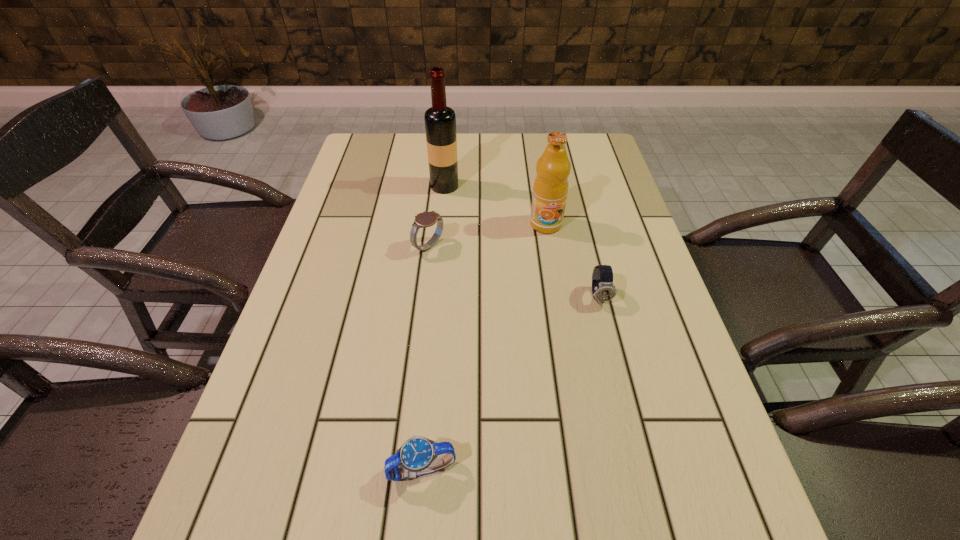
Identify the location of the farthest object. The width and height of the screenshot is (960, 540). (440, 121).

In order to click on the tallest object in this screenshot , I will do `click(440, 121)`.

The width and height of the screenshot is (960, 540). Find the location of `the second farthest object`. the second farthest object is located at coordinates (550, 189).

The image size is (960, 540). I want to click on the fourth shortest object, so click(550, 189).

Find the location of a particular element. the farthest watch is located at coordinates (425, 219).

The image size is (960, 540). What are the coordinates of `the rightmost object` in the screenshot? It's located at (603, 289).

Locate an element on the screen. the second farthest watch is located at coordinates (603, 289).

Where is `the nearest object`? This screenshot has height=540, width=960. the nearest object is located at coordinates (417, 456).

What are the coordinates of `the shortest watch` in the screenshot? It's located at (417, 456).

This screenshot has height=540, width=960. What are the coordinates of `free region located on the left of the tallest object` in the screenshot? It's located at (394, 186).